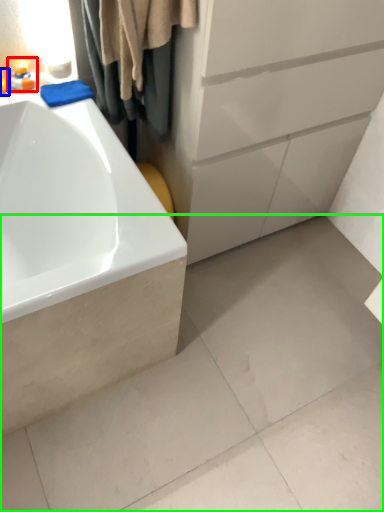
Question: Estimate the real-world distances between objects in this image. Which object is closer to toy (highlighted by a red box), toy (highlighted by a blue box) or concrete (highlighted by a green box)?

Choices:
 (A) toy
 (B) concrete

Answer: (A)